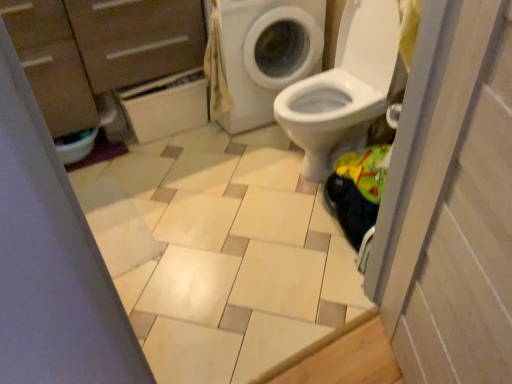
Question: Does white glossy screen door at right have a larger size compared to white matte cabinet at upper left?

Choices:
 (A) yes
 (B) no

Answer: (A)

Question: Can you confirm if white glossy screen door at right is shorter than white matte cabinet at upper left?

Choices:
 (A) yes
 (B) no

Answer: (B)

Question: Considering the relative positions of white glossy screen door at right and white matte cabinet at upper left in the image provided, is white glossy screen door at right to the left of white matte cabinet at upper left from the viewer's perspective?

Choices:
 (A) yes
 (B) no

Answer: (B)

Question: From the image's perspective, would you say white glossy screen door at right is positioned over white matte cabinet at upper left?

Choices:
 (A) no
 (B) yes

Answer: (A)

Question: Considering the relative sizes of white glossy screen door at right and white matte cabinet at upper left in the image provided, is white glossy screen door at right wider than white matte cabinet at upper left?

Choices:
 (A) yes
 (B) no

Answer: (B)

Question: From a real-world perspective, is white glossy screen door at right above or below brown wood dresser at upper left?

Choices:
 (A) above
 (B) below

Answer: (A)

Question: Is white glossy screen door at right in front of or behind brown wood dresser at upper left in the image?

Choices:
 (A) behind
 (B) front

Answer: (B)

Question: Is white glossy screen door at right inside or outside of brown wood dresser at upper left?

Choices:
 (A) outside
 (B) inside

Answer: (A)

Question: From the image's perspective, relative to brown wood dresser at upper left, is white glossy screen door at right above or below?

Choices:
 (A) below
 (B) above

Answer: (A)

Question: In terms of width, does brown wood dresser at upper left look wider or thinner when compared to white glossy washing machine at upper right?

Choices:
 (A) thin
 (B) wide

Answer: (A)

Question: From the image's perspective, relative to white glossy washing machine at upper right, is brown wood dresser at upper left above or below?

Choices:
 (A) below
 (B) above

Answer: (A)

Question: Is brown wood dresser at upper left inside the boundaries of white glossy washing machine at upper right, or outside?

Choices:
 (A) inside
 (B) outside

Answer: (B)

Question: From their relative heights in the image, would you say brown wood dresser at upper left is taller or shorter than white glossy washing machine at upper right?

Choices:
 (A) tall
 (B) short

Answer: (A)

Question: Choose the correct answer: Is brown wood dresser at upper left inside white matte cabinet at upper left or outside it?

Choices:
 (A) outside
 (B) inside

Answer: (A)

Question: Is brown wood dresser at upper left in front of or behind white matte cabinet at upper left in the image?

Choices:
 (A) front
 (B) behind

Answer: (A)